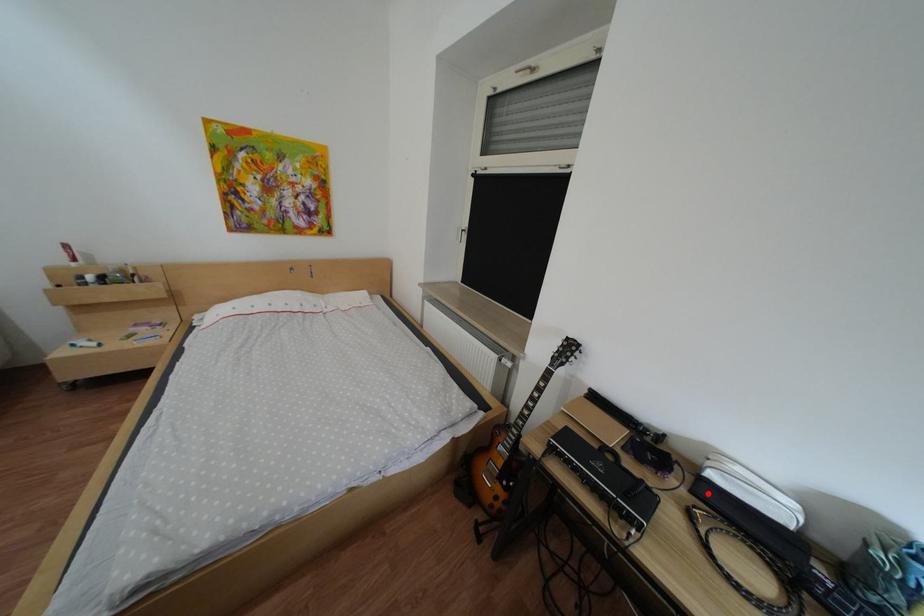
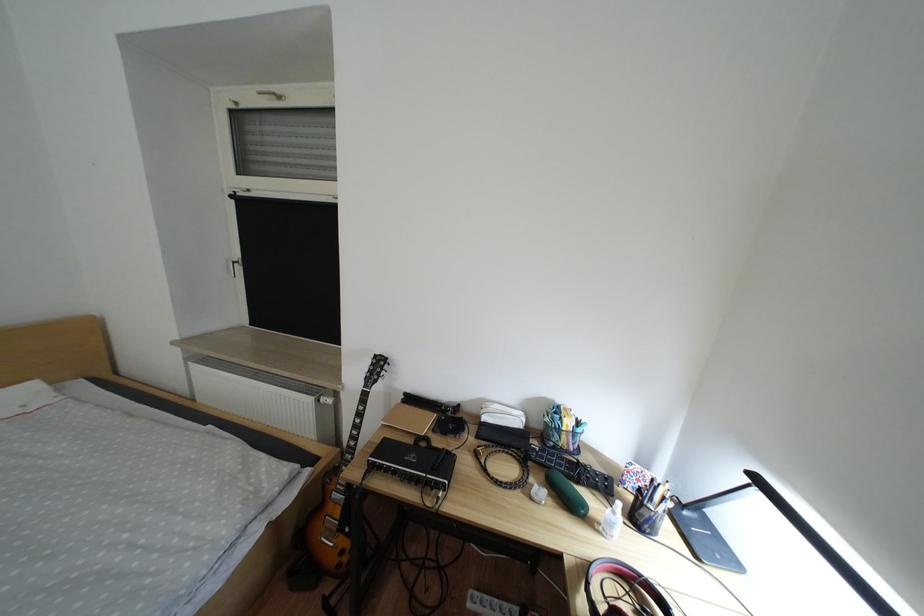
The point at the highlighted location is marked in the first image. Where is the corresponding point in the second image?

(492, 438)